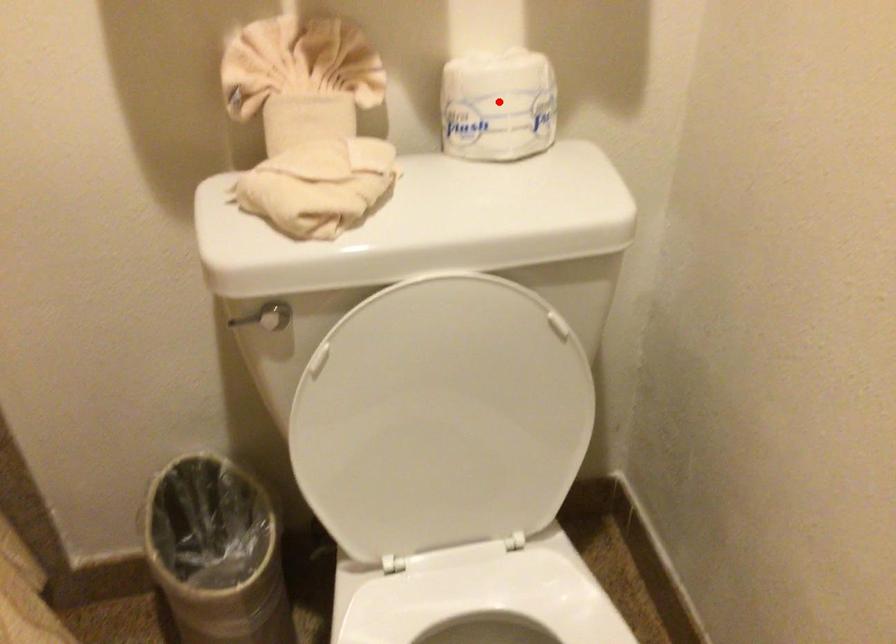
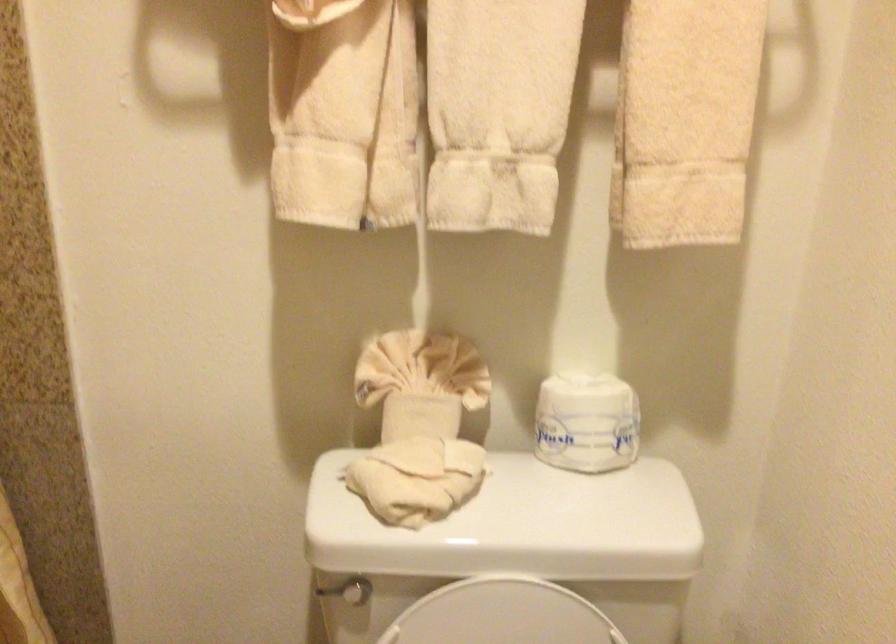
The point at the highlighted location is marked in the first image. Where is the corresponding point in the second image?

(587, 422)